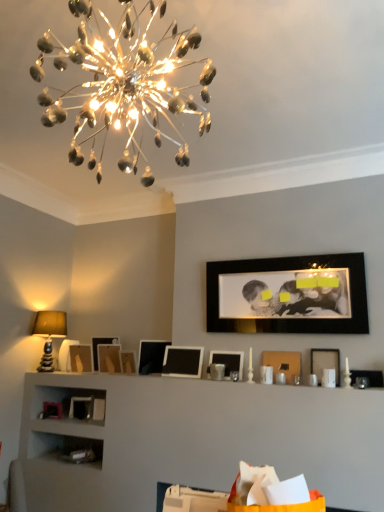
Question: Looking at the image, does black glossy picture frame at upper center, the tenth picture frame when ordered from left to right, seem bigger or smaller compared to black matte picture frame at center, which is the 6th picture frame from right to left?

Choices:
 (A) big
 (B) small

Answer: (A)

Question: Based on their positions, is black glossy picture frame at upper center, the tenth picture frame when ordered from left to right, located to the left or right of black matte picture frame at center, which is the 6th picture frame from right to left?

Choices:
 (A) left
 (B) right

Answer: (B)

Question: Estimate the real-world distances between objects in this image. Which object is farther from the matte black picture frame at lower left, the first picture frame positioned from the left?

Choices:
 (A) shiny metallic chandelier at upper center
 (B) wooden picture frame at center, the 8th picture frame from the right
 (C) matte wooden picture frame at center, which is counted as the ninth picture frame, starting from the right
 (D) matte black picture frame at right, placed as the first picture frame when sorted from right to left
 (E) black matte picture frame at center, arranged as the 7th picture frame when viewed from the left

Answer: (A)

Question: Considering the real-world distances, which object is closest to the matte black picture frame at lower left, the first picture frame positioned from the left?

Choices:
 (A) matte beige lampshade at left
 (B) black glossy picture frame at upper center, the tenth picture frame when ordered from left to right
 (C) matte black picture frame at lower left, the third picture frame viewed from the left
 (D) matte black picture frame at center right, the 11th picture frame positioned from the left
 (E) matte wooden picture frame at center, which is counted as the ninth picture frame, starting from the right

Answer: (C)